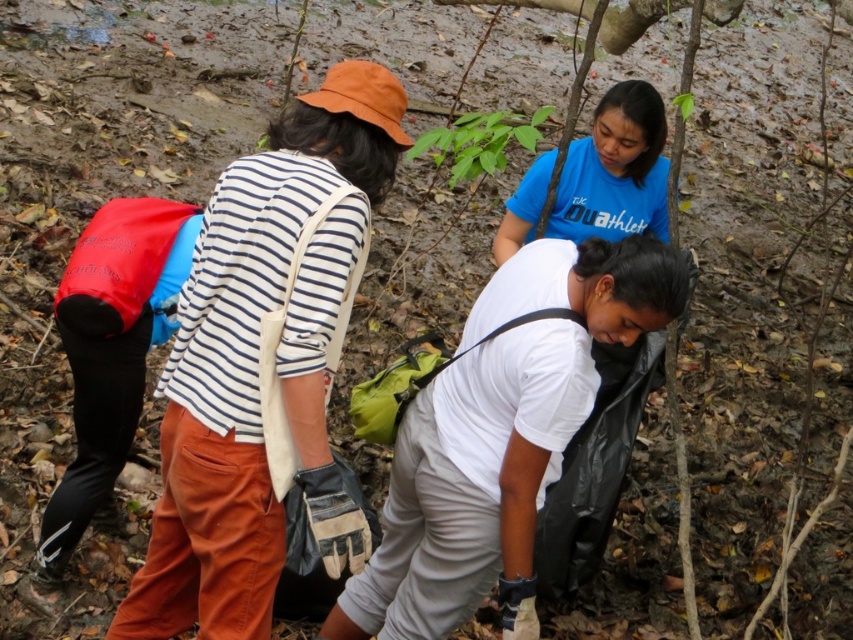
Question: Which point is closer to the camera taking this photo?

Choices:
 (A) (598, 291)
 (B) (608, 228)

Answer: (A)

Question: Is matte striped shirt at center below blue matte shirt at center?

Choices:
 (A) yes
 (B) no

Answer: (A)

Question: Which of these objects is positioned closest to the matte striped shirt at center?

Choices:
 (A) white matte shirt at center
 (B) blue matte shirt at center

Answer: (A)

Question: Among these points, which one is farthest from the camera?

Choices:
 (A) (631, 125)
 (B) (502, 342)

Answer: (A)

Question: Does matte striped shirt at center have a greater width compared to blue matte shirt at center?

Choices:
 (A) no
 (B) yes

Answer: (B)

Question: In this image, where is matte striped shirt at center located relative to white matte shirt at center?

Choices:
 (A) below
 (B) above

Answer: (B)